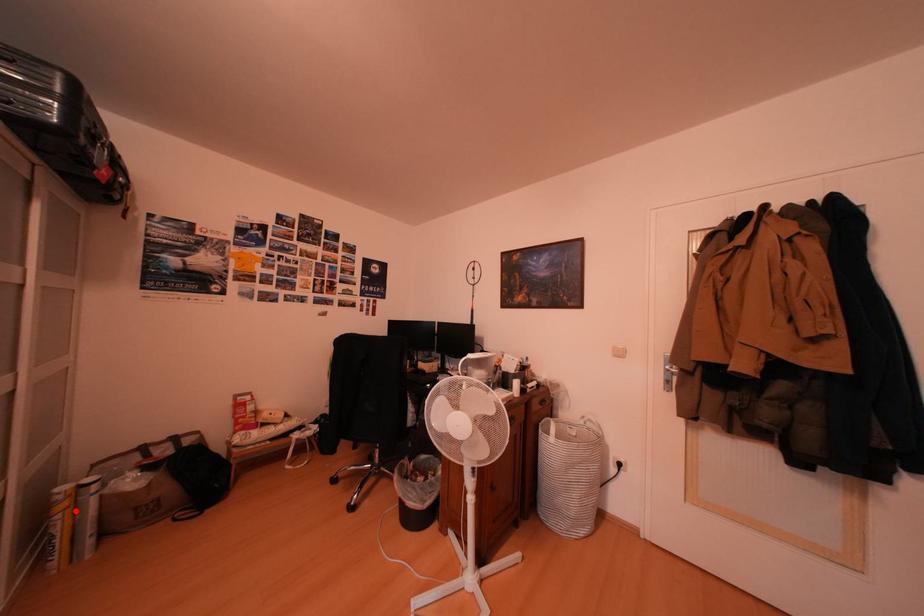
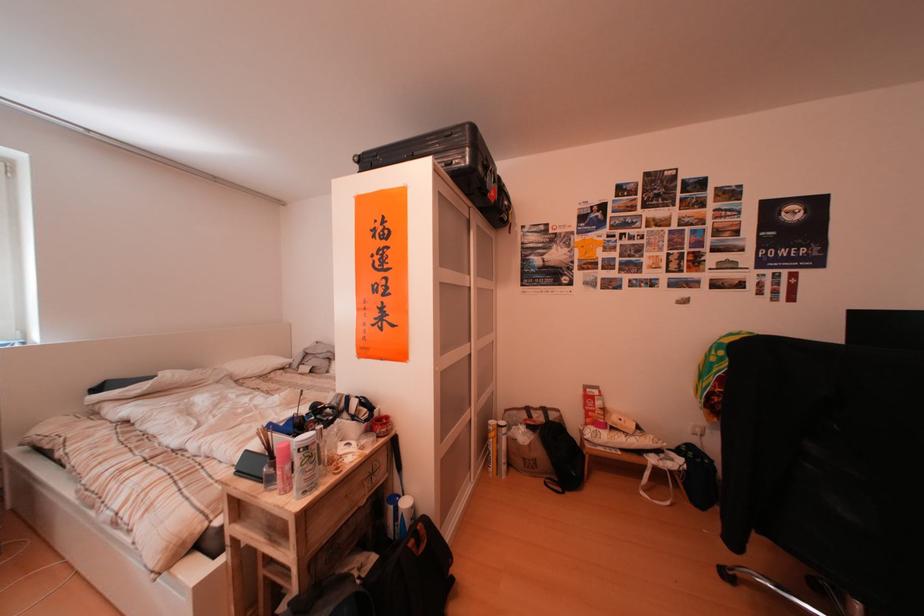
Question: I am providing you with two images of the same scene from different viewpoints. A red point is marked on the first image. Is the red point's position out of view in image 2?

Choices:
 (A) Yes
 (B) No

Answer: (B)